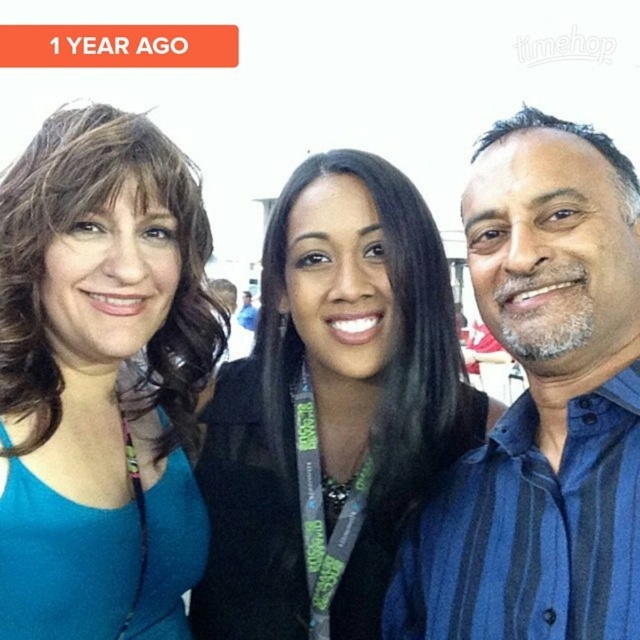
You are standing at a distance of 100 feet from the scene. There is a point marked at coordinates point (243, 468). Can you estimate whether this point is closer to you or farther than 80 feet?

The point (243, 468) is 86.32 feet away from the viewer, which is farther than 80 feet.

You are a photographer trying to adjust the lighting for a group photo. You notice the black fabric jacket at center and the matte teal tank top at left. Which clothing item requires more light to avoid appearing too dark in the photo?

The black fabric jacket at center requires more light because it is larger and absorbs more light, making it appear darker in the photo.

You are taking a photo of two people wearing a black fabric jacket at center and a blue striped shirt at center. Which clothing item is closer to the camera?

The black fabric jacket at center is closer to the camera than the blue striped shirt at center.